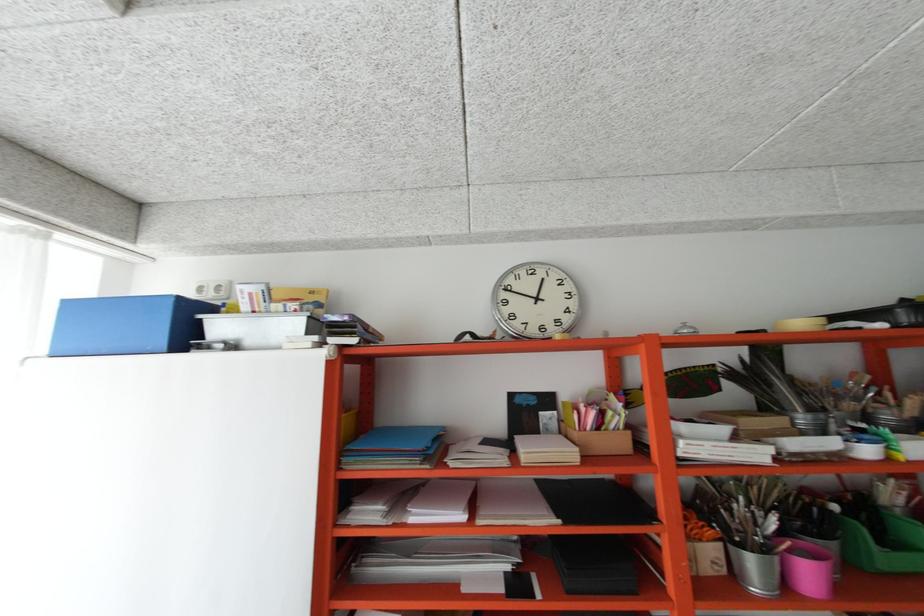
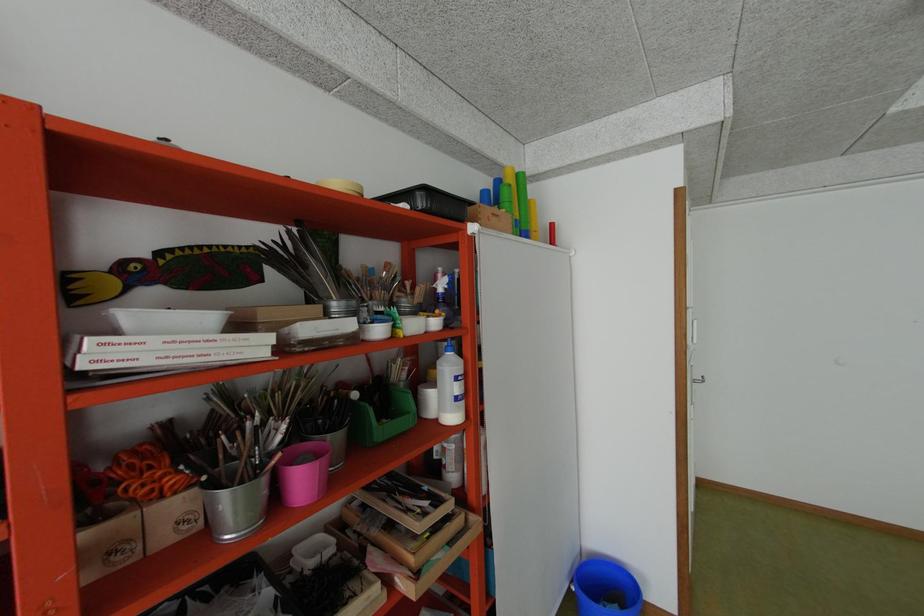
Question: The images are taken continuously from a first-person perspective. In which direction is your viewpoint rotating?

Choices:
 (A) Left
 (B) Right
 (C) Up
 (D) Down

Answer: (B)